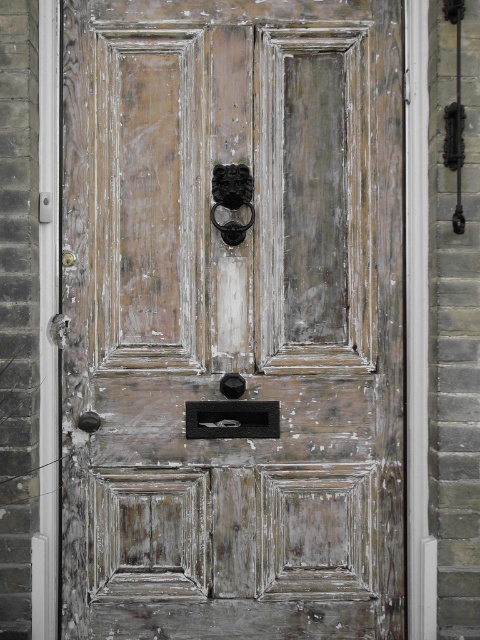
Measure the distance between point (x=116, y=202) and camera.

The distance of point (x=116, y=202) from camera is 9.12 feet.

Is point (267, 260) in front of point (224, 179)?

No, (267, 260) is behind (224, 179).

What do you see at coordinates (232, 317) in the screenshot? I see `distressed wood door at center` at bounding box center [232, 317].

Locate an element on the screen. This screenshot has width=480, height=640. distressed wood door at center is located at coordinates (232, 317).